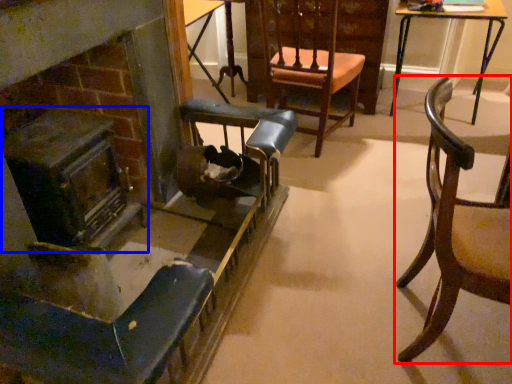
Question: Among these objects, which one is nearest to the camera, chair (highlighted by a red box) or fireplace (highlighted by a blue box)?

Choices:
 (A) chair
 (B) fireplace

Answer: (A)